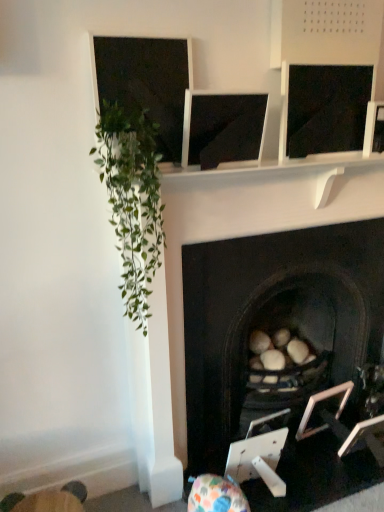
Question: Does metallic silver picture frame at lower right, arranged as the 1th picture frame when viewed from the left, lie behind matte black monitor at center?

Choices:
 (A) yes
 (B) no

Answer: (A)

Question: Considering the relative sizes of metallic silver picture frame at lower right, arranged as the 1th picture frame when viewed from the left, and matte black monitor at center in the image provided, is metallic silver picture frame at lower right, arranged as the 1th picture frame when viewed from the left, bigger than matte black monitor at center?

Choices:
 (A) no
 (B) yes

Answer: (B)

Question: From a real-world perspective, does metallic silver picture frame at lower right, marked as the 2th picture frame in a right-to-left arrangement, stand above matte black monitor at center?

Choices:
 (A) yes
 (B) no

Answer: (B)

Question: From the image's perspective, is metallic silver picture frame at lower right, arranged as the 1th picture frame when viewed from the left, over matte black monitor at center?

Choices:
 (A) yes
 (B) no

Answer: (B)

Question: Is metallic silver picture frame at lower right, marked as the 2th picture frame in a right-to-left arrangement, located outside matte black monitor at center?

Choices:
 (A) yes
 (B) no

Answer: (A)

Question: Does metallic silver picture frame at lower right, marked as the 2th picture frame in a right-to-left arrangement, have a greater width compared to matte black monitor at center?

Choices:
 (A) no
 (B) yes

Answer: (B)

Question: Is the position of green leafy plant at left more distant than that of wooden swivel chair at lower left?

Choices:
 (A) yes
 (B) no

Answer: (B)

Question: Can you confirm if green leafy plant at left is wider than wooden swivel chair at lower left?

Choices:
 (A) no
 (B) yes

Answer: (B)

Question: Is green leafy plant at left bigger than wooden swivel chair at lower left?

Choices:
 (A) yes
 (B) no

Answer: (A)

Question: Is green leafy plant at left at the right side of wooden swivel chair at lower left?

Choices:
 (A) no
 (B) yes

Answer: (B)

Question: From the image's perspective, is green leafy plant at left located above wooden swivel chair at lower left?

Choices:
 (A) no
 (B) yes

Answer: (B)

Question: From the image's perspective, does green leafy plant at left appear lower than wooden swivel chair at lower left?

Choices:
 (A) yes
 (B) no

Answer: (B)

Question: Does matte black monitor at center have a larger size compared to wooden swivel chair at lower left?

Choices:
 (A) no
 (B) yes

Answer: (A)